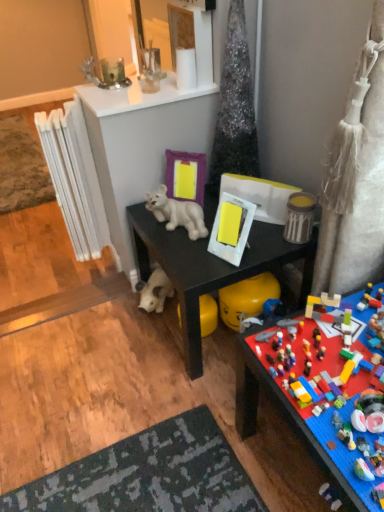
Question: Is multicolored plastic lego set at lower right, which is counted as the first toy, starting from the bottom, taller than white plastic radiator at left?

Choices:
 (A) no
 (B) yes

Answer: (A)

Question: Considering the relative sizes of multicolored plastic lego set at lower right, the 6th toy from the top, and white plastic radiator at left in the image provided, is multicolored plastic lego set at lower right, the 6th toy from the top, smaller than white plastic radiator at left?

Choices:
 (A) yes
 (B) no

Answer: (B)

Question: Is multicolored plastic lego set at lower right, the 6th toy from the top, oriented away from white plastic radiator at left?

Choices:
 (A) yes
 (B) no

Answer: (B)

Question: Does multicolored plastic lego set at lower right, the 6th toy from the top, contain white plastic radiator at left?

Choices:
 (A) no
 (B) yes

Answer: (A)

Question: Is multicolored plastic lego set at lower right, which is counted as the first toy, starting from the bottom, not near white plastic radiator at left?

Choices:
 (A) yes
 (B) no

Answer: (A)

Question: Is white glossy plastic lion at center, which is counted as the third toy, starting from the top, in front of or behind black matte desk at center in the image?

Choices:
 (A) behind
 (B) front

Answer: (A)

Question: Considering the positions of point tap(168, 202) and point tap(193, 351), is point tap(168, 202) closer or farther from the camera than point tap(193, 351)?

Choices:
 (A) closer
 (B) farther

Answer: (B)

Question: From their relative heights in the image, would you say white glossy plastic lion at center, which is counted as the third toy, starting from the top, is taller or shorter than black matte desk at center?

Choices:
 (A) short
 (B) tall

Answer: (A)

Question: Is white glossy plastic lion at center, which is counted as the 4th toy, starting from the bottom, to the left or to the right of black matte desk at center in the image?

Choices:
 (A) right
 (B) left

Answer: (B)

Question: Is white plastic radiator at left inside or outside of white glossy picture frame at center, the 1th picture frame positioned from the right?

Choices:
 (A) outside
 (B) inside

Answer: (A)

Question: Considering the positions of white plastic radiator at left and white glossy picture frame at center, the 1th picture frame positioned from the right, in the image, is white plastic radiator at left taller or shorter than white glossy picture frame at center, the 1th picture frame positioned from the right,?

Choices:
 (A) short
 (B) tall

Answer: (B)

Question: From the image's perspective, is white plastic radiator at left above or below white glossy picture frame at center, positioned as the 2th picture frame in top-to-bottom order?

Choices:
 (A) below
 (B) above

Answer: (B)

Question: Does point (66, 159) appear closer or farther from the camera than point (235, 204)?

Choices:
 (A) farther
 (B) closer

Answer: (A)

Question: Is multicolored plastic lego set at lower right, the 6th toy from the top, in front of or behind white plush toy at lower center, which is the 2th toy from bottom to top, in the image?

Choices:
 (A) behind
 (B) front

Answer: (B)

Question: Do you think multicolored plastic lego set at lower right, the 6th toy from the top, is within white plush toy at lower center, acting as the fifth toy starting from the top, or outside of it?

Choices:
 (A) outside
 (B) inside

Answer: (A)